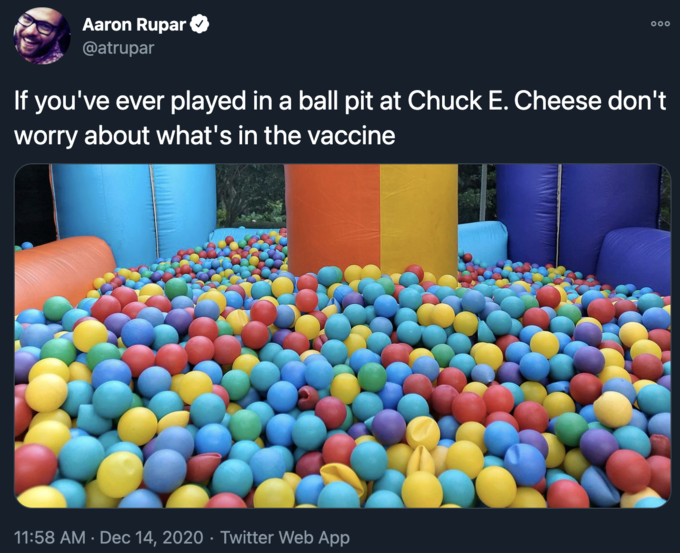
This screenshot has width=680, height=553. In order to click on light blue padded object in this screenshot , I will do `click(90, 215)`.